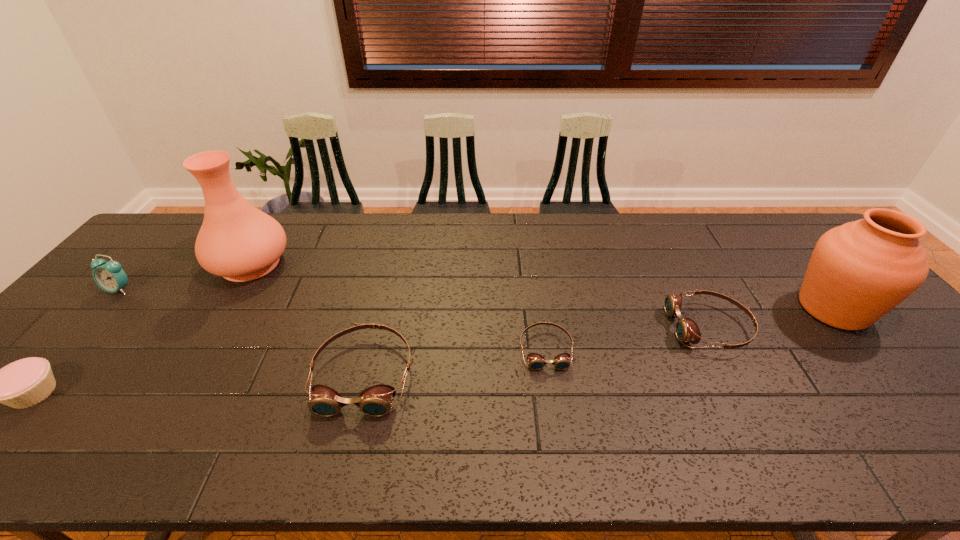
Where is `vacant area that lies between the rightmost object and the sixth object from left to right`? This screenshot has height=540, width=960. vacant area that lies between the rightmost object and the sixth object from left to right is located at coordinates (772, 318).

Locate an element on the screen. Image resolution: width=960 pixels, height=540 pixels. empty location between the second goggles from right to left and the second tallest goggles is located at coordinates (628, 338).

This screenshot has width=960, height=540. Identify the location of free point between the fifth shortest object and the urn. (476, 299).

This screenshot has height=540, width=960. What are the coordinates of `free space between the fifth shortest object and the second goggles from left to right` in the screenshot? It's located at (333, 319).

Where is `empty space between the shortest object and the fourth object from left to right`? The width and height of the screenshot is (960, 540). empty space between the shortest object and the fourth object from left to right is located at coordinates (455, 361).

Where is `object that stands as the fourth closest to the fourth object from right to left`? The width and height of the screenshot is (960, 540). object that stands as the fourth closest to the fourth object from right to left is located at coordinates (110, 276).

Point out which object is positioned as the fourth nearest to the fifth object from right to left. Please provide its 2D coordinates. Your answer should be formatted as a tuple, i.e. [(x, y)], where the tuple contains the x and y coordinates of a point satisfying the conditions above.

[(536, 361)]

Locate an element on the screen. The image size is (960, 540). the second closest goggles to the fourth object from right to left is located at coordinates (686, 329).

I want to click on the second closest goggles to the fourth object from left to right, so click(x=686, y=329).

At what (x,y) coordinates should I click in order to perform the action: click on vacant space that satisfies the following two spatial constraints: 1. through the lenses of the rightmost goggles; 2. through the lenses of the fourth object from right to left. Please return your answer as a coordinate pair (x, y). Image resolution: width=960 pixels, height=540 pixels. Looking at the image, I should click on (734, 374).